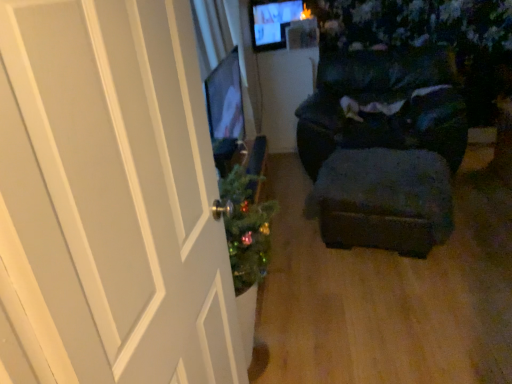
Question: From the image's perspective, is dark fabric chair at center positioned above or below white wood door at left?

Choices:
 (A) above
 (B) below

Answer: (A)

Question: From a real-world perspective, relative to white wood door at left, is dark fabric chair at center vertically above or below?

Choices:
 (A) below
 (B) above

Answer: (A)

Question: Based on their relative distances, which object is nearer to the velvet dark blue stool at center?

Choices:
 (A) white wood door at left
 (B) dark fabric chair at center

Answer: (B)

Question: Estimate the real-world distances between objects in this image. Which object is closer to the white wood door at left?

Choices:
 (A) velvet dark blue stool at center
 (B) dark fabric chair at center

Answer: (A)